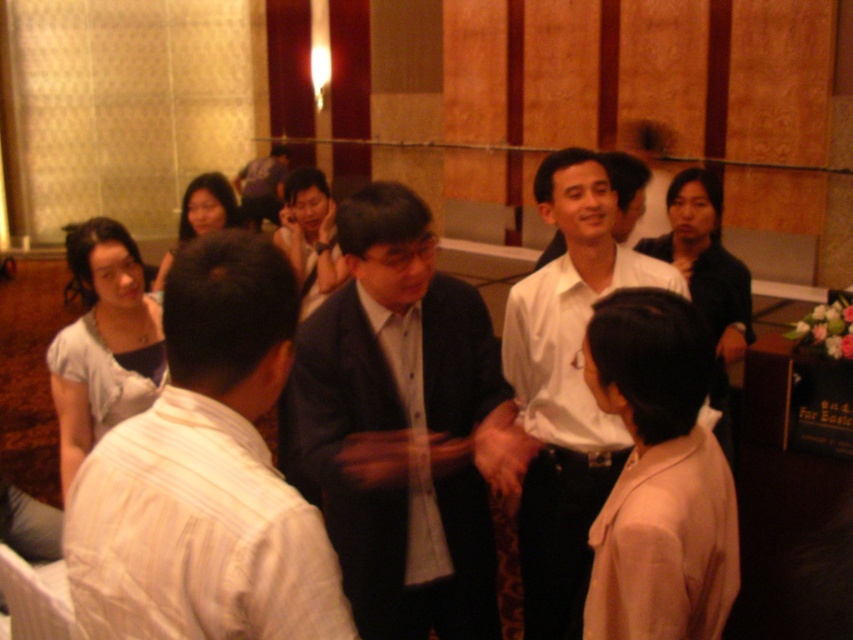
Question: Does matte black hair at center come behind matte black dress at center?

Choices:
 (A) no
 (B) yes

Answer: (B)

Question: Which of the following is the farthest from the observer?

Choices:
 (A) light gray fabric dress at lower left
 (B) matte black dress at center
 (C) beige fabric blouse at center
 (D) matte black suit at center

Answer: (B)

Question: Does light gray fabric dress at lower left have a smaller size compared to matte black hair at center?

Choices:
 (A) no
 (B) yes

Answer: (B)

Question: Is light gray fabric dress at lower left closer to camera compared to matte black hair at center?

Choices:
 (A) yes
 (B) no

Answer: (A)

Question: Estimate the real-world distances between objects in this image. Which object is farther from the light gray fabric dress at lower left?

Choices:
 (A) dark blue suit at center
 (B) white striped shirt at lower left

Answer: (B)

Question: Based on their relative distances, which object is farther from the matte black hair at center?

Choices:
 (A) matte black suit at center
 (B) light gray fabric dress at lower left
 (C) dark blue suit at center
 (D) white striped shirt at lower left

Answer: (D)